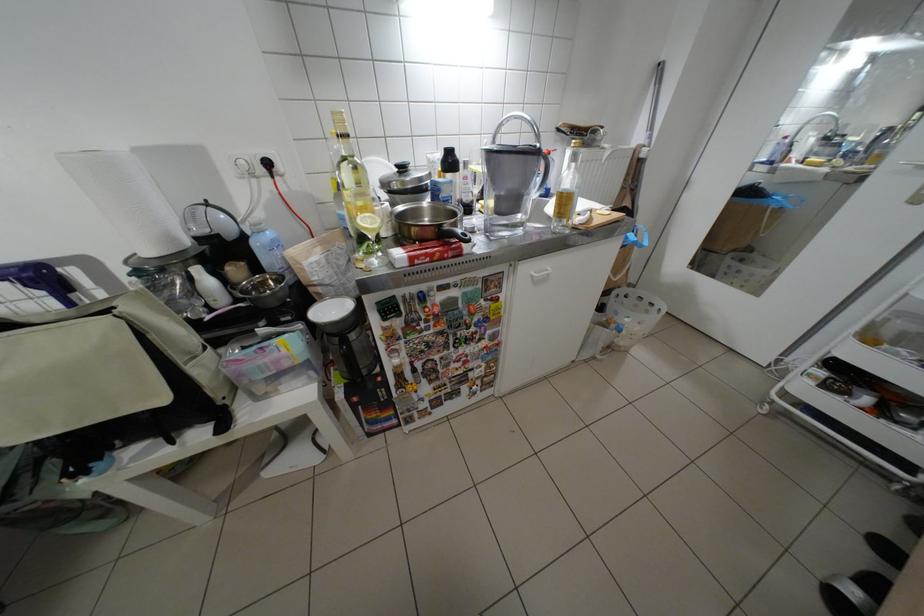
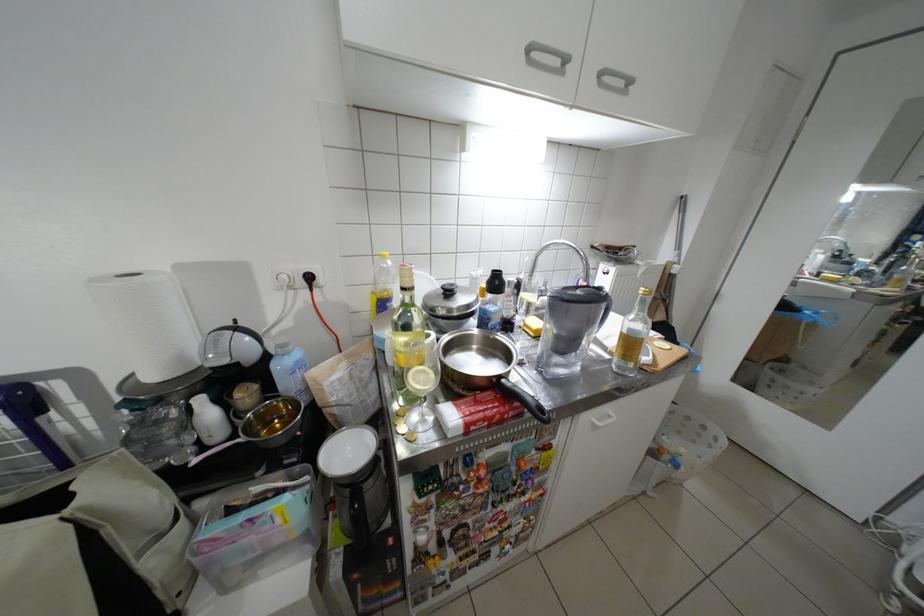
The point at (472, 257) is marked in the first image. Where is the corresponding point in the second image?

(532, 415)